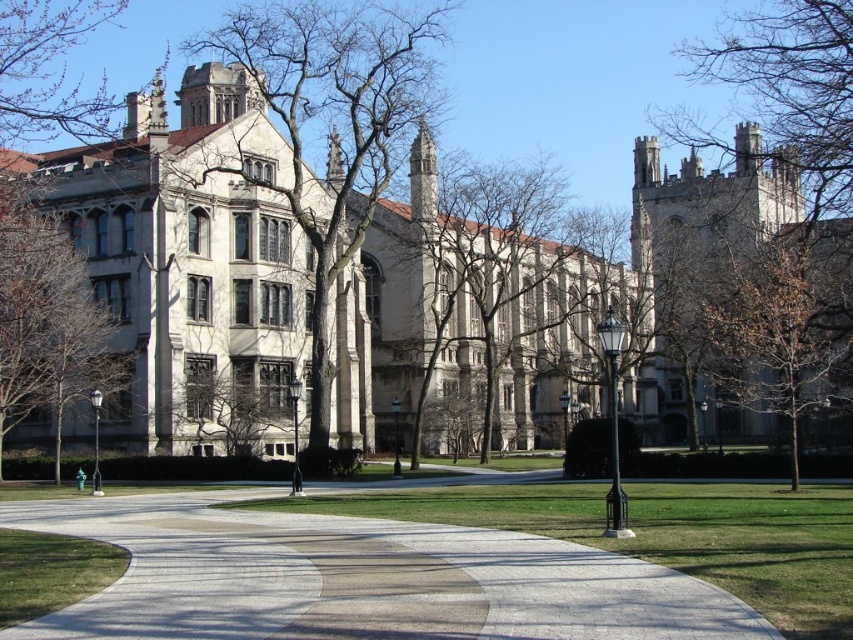
Question: Which object appears closest to the camera in this image?

Choices:
 (A) brown textured tree at center
 (B) smooth concrete path at center
 (C) green leafy tree at left

Answer: (B)

Question: Which point is closer to the camera?

Choices:
 (A) bare branches at left
 (B) brown textured tree at center

Answer: (A)

Question: Which point is farther to the camera?

Choices:
 (A) (422, 284)
 (B) (4, 234)

Answer: (A)

Question: Is smooth concrete path at center bigger than brown leafless tree at right?

Choices:
 (A) no
 (B) yes

Answer: (A)

Question: Can you confirm if brown textured tree at center is wider than brown leafless tree at right?

Choices:
 (A) no
 (B) yes

Answer: (B)

Question: Is brown textured tree at center in front of green leafy tree at left?

Choices:
 (A) no
 (B) yes

Answer: (A)